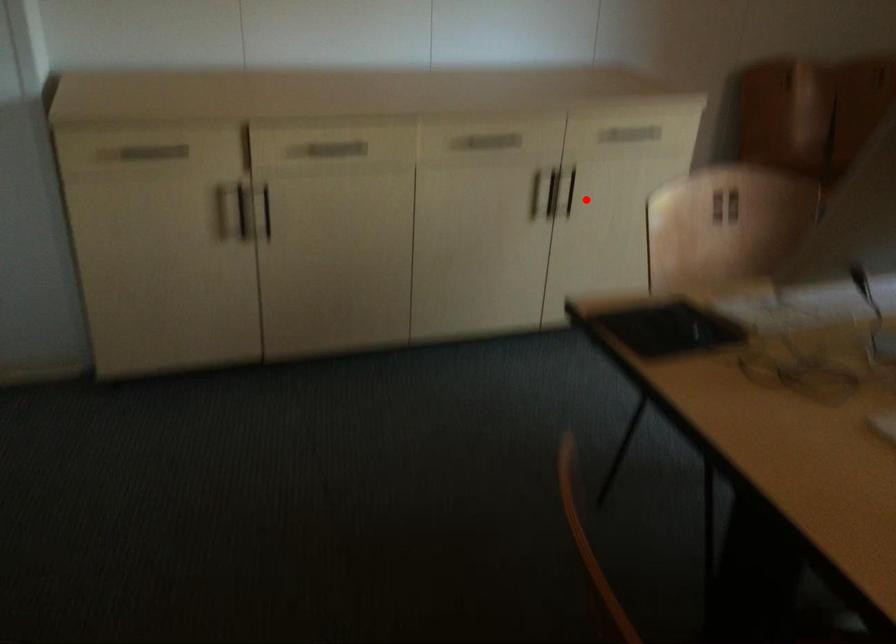
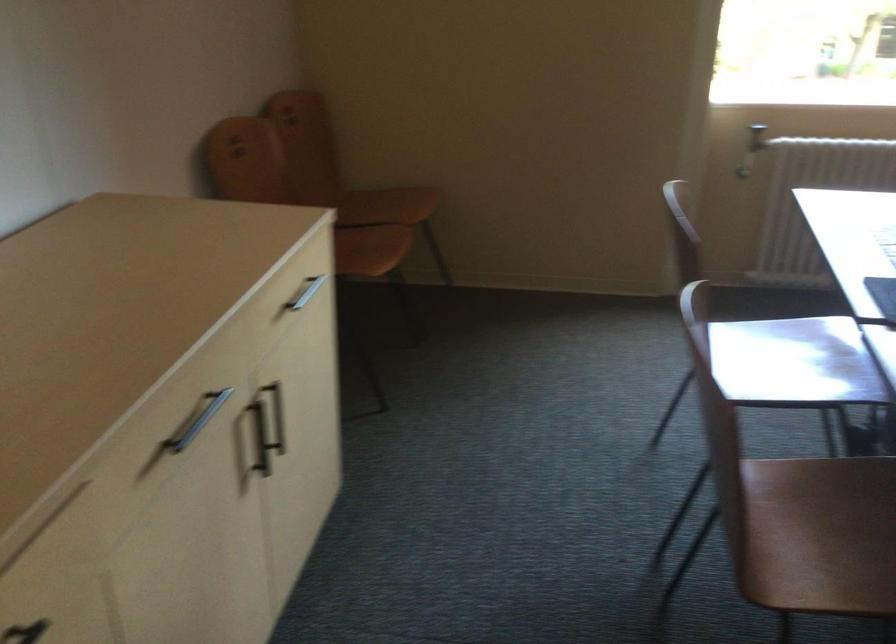
In the second image, find the point that corresponds to the highlighted location in the first image.

(277, 415)